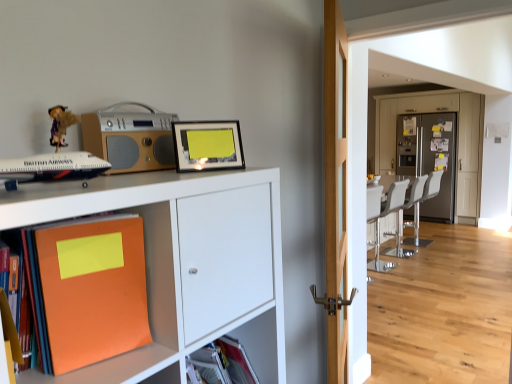
In order to face orange matte book at lower left, which is the second book in right-to-left order, should I rotate leftwards or rightwards?

You should rotate left by 31.132 degrees.

How much space does orange matte book at lower left, which is the second book in right-to-left order, occupy vertically?

orange matte book at lower left, which is the second book in right-to-left order, is 12.31 inches in height.

This screenshot has height=384, width=512. Describe the element at coordinates (130, 138) in the screenshot. I see `silver metallic stereo at upper left` at that location.

I want to click on matte plastic shelf at lower center, so click(x=262, y=343).

In order to face white leather swivel chair at center, should I rotate leftwards or rightwards?

You should rotate right by 21.320 degrees.

What do you see at coordinates (207, 145) in the screenshot?
I see `matte black picture frame at upper center` at bounding box center [207, 145].

Identify the location of white leather chair at right. The width and height of the screenshot is (512, 384). (396, 225).

Considering the relative sizes of white leather swivel chair at center and white leather chair at right in the image provided, is white leather swivel chair at center wider than white leather chair at right?

Yes.

From the image's perspective, is white leather swivel chair at center above or below white leather chair at right?

white leather swivel chair at center is above white leather chair at right.

Identify the location of the 2nd book in front of the metallic gray refrigerator at center. (32, 290).

Considering the relative sizes of metallic gray refrigerator at center and orange matte book at lower left, the first book viewed from the left, in the image provided, is metallic gray refrigerator at center wider than orange matte book at lower left, the first book viewed from the left,?

Indeed, metallic gray refrigerator at center has a greater width compared to orange matte book at lower left, the first book viewed from the left.

Is metallic gray refrigerator at center far from orange matte book at lower left, which is the second book in right-to-left order?

metallic gray refrigerator at center is positioned a significant distance from orange matte book at lower left, which is the second book in right-to-left order.

Based on the photo, from a real-world perspective, which is physically above, metallic gray refrigerator at center or orange matte book at lower left, which is the second book in right-to-left order?

orange matte book at lower left, which is the second book in right-to-left order, is physically above.

Considering the relative sizes of silver metallic stereo at upper left and orange matte book at lower left, the first book viewed from the right, in the image provided, is silver metallic stereo at upper left shorter than orange matte book at lower left, the first book viewed from the right,?

Yes.

Which is more to the left, silver metallic stereo at upper left or orange matte book at lower left, the first book viewed from the right?

From the viewer's perspective, silver metallic stereo at upper left appears more on the left side.

Where is `stereo to the left of orange matte book at lower left, the first book viewed from the right`? The width and height of the screenshot is (512, 384). stereo to the left of orange matte book at lower left, the first book viewed from the right is located at coordinates (130, 138).

Is silver metallic stereo at upper left surrounding orange matte book at lower left, the first book viewed from the right?

Definitely not — orange matte book at lower left, the first book viewed from the right, is not inside silver metallic stereo at upper left.

Could you tell me if matte plastic shelf at lower center is facing silver metallic stereo at upper left?

No, matte plastic shelf at lower center is not turned towards silver metallic stereo at upper left.

Choose the correct answer: Is matte plastic shelf at lower center inside silver metallic stereo at upper left or outside it?

matte plastic shelf at lower center is located beyond the bounds of silver metallic stereo at upper left.

From a real-world perspective, is matte plastic shelf at lower center under silver metallic stereo at upper left?

Yes, from a real-world perspective, matte plastic shelf at lower center is beneath silver metallic stereo at upper left.

At what (x,y) coordinates should I click in order to perform the action: click on shelf lying in front of the silver metallic stereo at upper left. Please return your answer as a coordinate pair (x, y). The height and width of the screenshot is (384, 512). Looking at the image, I should click on (262, 343).

Does white leather swivel chair at center have a greater width compared to light wood door at center?

Yes, white leather swivel chair at center is wider than light wood door at center.

Is white leather swivel chair at center positioned with its back to light wood door at center?

No, white leather swivel chair at center is not facing the opposite direction of light wood door at center.

Is white leather swivel chair at center inside the boundaries of light wood door at center, or outside?

white leather swivel chair at center cannot be found inside light wood door at center.

Is the surface of white leather swivel chair at center in direct contact with light wood door at center?

No, white leather swivel chair at center is not next to light wood door at center.

Considering the relative positions of silver metallic stereo at upper left and matte black airplane at left in the image provided, is silver metallic stereo at upper left to the left of matte black airplane at left from the viewer's perspective?

No.

How distant is silver metallic stereo at upper left from matte black airplane at left?

They are 7.92 inches apart.

How different are the orientations of silver metallic stereo at upper left and matte black airplane at left in degrees?

There is a 68.7-degree angle between the facing directions of silver metallic stereo at upper left and matte black airplane at left.

Between point (122, 154) and point (40, 165), which one is positioned behind?

The point (122, 154) is more distant.

Is white leather swivel chair at center at the back of light wood door at center?

No, light wood door at center is not facing away from white leather swivel chair at center.

From the picture: Would you say white leather swivel chair at center is part of light wood door at center's contents?

Definitely not — white leather swivel chair at center is not inside light wood door at center.

From the image's perspective, which one is positioned higher, light wood door at center or white leather swivel chair at center?

white leather swivel chair at center, from the image's perspective.

The height and width of the screenshot is (384, 512). In order to click on chair below the white leather swivel chair at center (from a real-world perspective) in this screenshot , I will do `click(396, 225)`.

This screenshot has width=512, height=384. I want to click on corridor that appears behind the orange matte book at lower left, which is the second book in right-to-left order, so click(421, 79).

Estimate the real-world distances between objects in this image. Which object is closer to matte black picture frame at upper center, orange matte book at lower left, the first book viewed from the right, or silver metallic stereo at upper left?

Among the two, silver metallic stereo at upper left is located nearer to matte black picture frame at upper center.

Based on their spatial positions, is white leather chair at right or orange matte book at lower left, which is the second book in right-to-left order, further from matte plastic shelf at lower center?

white leather chair at right lies further to matte plastic shelf at lower center than the other object.

Looking at the image, which one is located closer to matte black airplane at left, silver metallic stereo at upper left or metallic gray refrigerator at center?

Based on the image, silver metallic stereo at upper left appears to be nearer to matte black airplane at left.

Looking at the image, which one is located closer to orange matte book at lower left, which is the second book in right-to-left order, matte plastic shelf at lower center or matte black airplane at left?

Among the two, matte black airplane at left is located nearer to orange matte book at lower left, which is the second book in right-to-left order.

Considering their positions, is white leather chair at right positioned closer to metallic gray refrigerator at center than white leather swivel chair at center?

white leather chair at right.

Looking at the image, which one is located closer to matte black airplane at left, light wood door at center or white leather chair at right?

Based on the image, light wood door at center appears to be nearer to matte black airplane at left.

Looking at the image, which one is located further to metallic gray refrigerator at center, white leather swivel chair at center or orange matte book at lower left, the first book viewed from the right?

orange matte book at lower left, the first book viewed from the right, is further to metallic gray refrigerator at center.

From the image, which object appears to be nearer to white leather swivel chair at center, light wood door at center or orange matte book at lower left, which is counted as the second book, starting from the left?

light wood door at center.

The width and height of the screenshot is (512, 384). I want to click on toy that lies between silver metallic stereo at upper left and matte plastic shelf at lower center from top to bottom, so click(53, 159).

Identify the location of book between silver metallic stereo at upper left and light wood door at center. Image resolution: width=512 pixels, height=384 pixels. (89, 289).

I want to click on corridor positioned between silver metallic stereo at upper left and white leather swivel chair at center from near to far, so click(x=421, y=79).

In order to click on stereo between matte black airplane at left and metallic gray refrigerator at center in this screenshot , I will do `click(130, 138)`.